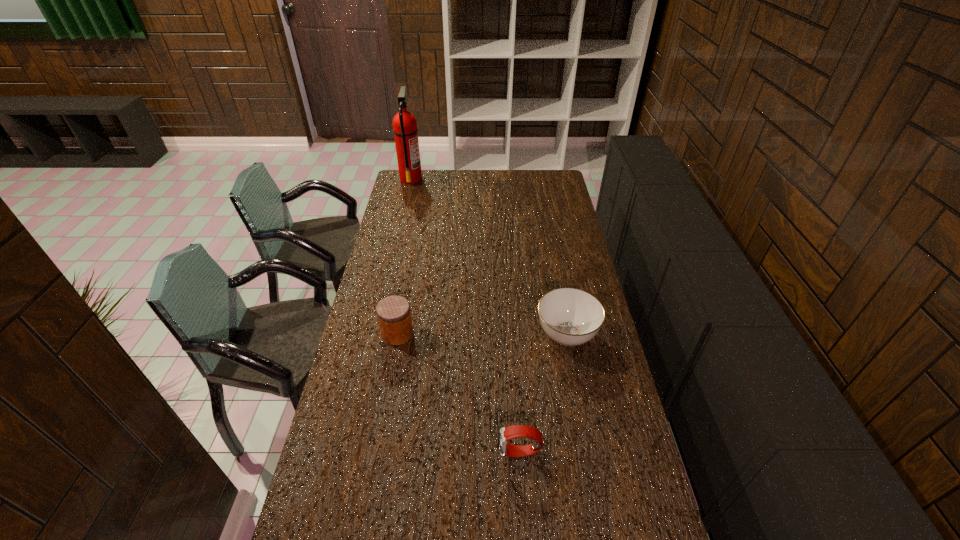
Locate an element on the screen. The height and width of the screenshot is (540, 960). empty space between the jar and the second object from right to left is located at coordinates (459, 393).

At what (x,y) coordinates should I click in order to perform the action: click on vacant area between the nearest object and the chinaware. Please return your answer as a coordinate pair (x, y). Looking at the image, I should click on [543, 394].

You are a GUI agent. You are given a task and a screenshot of the screen. Output one action in this format:
    pyautogui.click(x=<x>, y=<y>)
    Task: Click on the empty location between the jar and the fire extinguisher
    
    Given the screenshot: What is the action you would take?
    [x=404, y=256]

Where is `free space between the watch and the fire extinguisher`? The height and width of the screenshot is (540, 960). free space between the watch and the fire extinguisher is located at coordinates (466, 316).

I want to click on free space between the rightmost object and the watch, so click(543, 394).

This screenshot has width=960, height=540. Identify the location of unoccupied position between the fire extinguisher and the jar. (404, 256).

The height and width of the screenshot is (540, 960). I want to click on object that is the third closest to the rightmost object, so click(x=405, y=129).

Choose which object is the third nearest neighbor to the rightmost object. Please provide its 2D coordinates. Your answer should be formatted as a tuple, i.e. [(x, y)], where the tuple contains the x and y coordinates of a point satisfying the conditions above.

[(405, 129)]

You are a GUI agent. You are given a task and a screenshot of the screen. Output one action in this format:
    pyautogui.click(x=<x>, y=<y>)
    Task: Click on the free point that satisfies the following two spatial constraints: 1. on the side of the fire extinguisher near the handle; 2. on the right side of the jar
    This screenshot has width=960, height=540.
    Given the screenshot: What is the action you would take?
    pyautogui.click(x=375, y=333)

Locate an element on the screen. Image resolution: width=960 pixels, height=540 pixels. vacant point that satisfies the following two spatial constraints: 1. on the side of the jar near the handle; 2. on the left side of the farthest object is located at coordinates (375, 333).